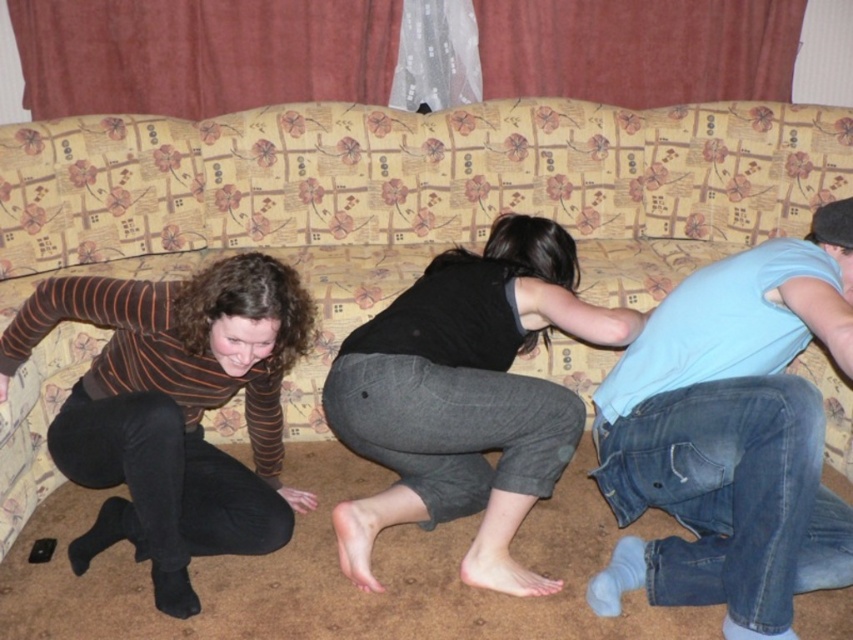
Can you confirm if blue denim jeans at lower right is wider than striped jersey at lower left?

In fact, blue denim jeans at lower right might be narrower than striped jersey at lower left.

Can you confirm if blue denim jeans at lower right is positioned below striped jersey at lower left?

Actually, blue denim jeans at lower right is above striped jersey at lower left.

Is point (659, 330) positioned in front of point (178, 301)?

No, it is not.

At what (x,y) coordinates should I click in order to perform the action: click on blue denim jeans at lower right. Please return your answer as a coordinate pair (x, y). The image size is (853, 640). Looking at the image, I should click on (730, 435).

Is point (187, 356) in front of point (432, 410)?

No, it is not.

Where is `striped jersey at lower left`? striped jersey at lower left is located at coordinates pyautogui.click(x=175, y=410).

This screenshot has width=853, height=640. Identify the location of striped jersey at lower left. (175, 410).

Can you confirm if blue denim jeans at lower right is thinner than black matte pants at center?

Yes, blue denim jeans at lower right is thinner than black matte pants at center.

Is blue denim jeans at lower right above black matte pants at center?

Yes.

This screenshot has height=640, width=853. Identify the location of blue denim jeans at lower right. (730, 435).